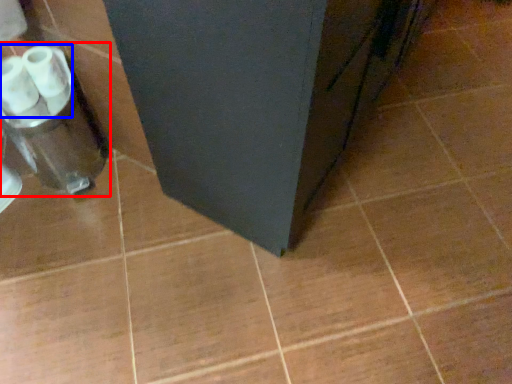
Question: Which point is further to the camera, blender (highlighted by a red box) or toilet paper (highlighted by a blue box)?

Choices:
 (A) blender
 (B) toilet paper

Answer: (A)